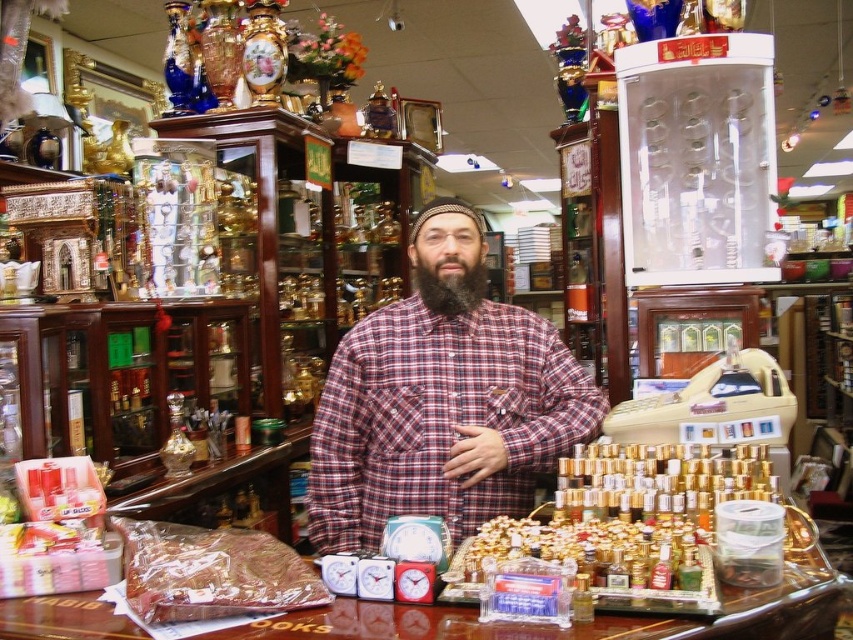
You are a customer in the shop and want to take a photo of the plaid cotton shirt at center. You have a camera that requires a minimum distance of 1.5 meters to focus properly. Can you stand at your current position and take the photo without moving closer?

The plaid cotton shirt at center and camera are 1.68 meters apart from each other. Since 1.68 meters is greater than the minimum required 1.5 meters, you can take the photo without moving closer.

You are a customer in the shop and see the point marked at coordinates (440, 419). Which object is this point located on?

The point at coordinates (440, 419) is located on the plaid cotton shirt at center.